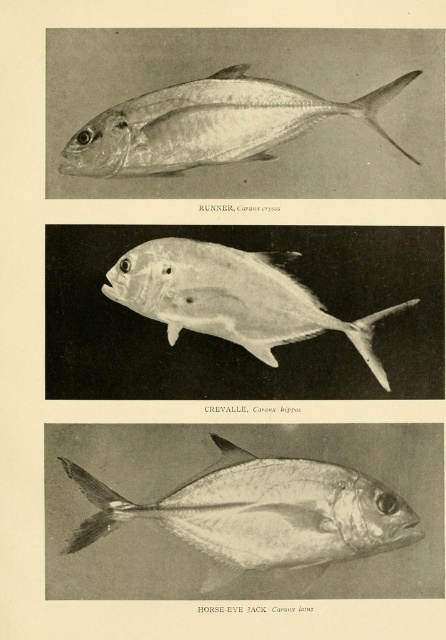
In the scene shown: You are an underwater photographer aiming to capture a closeup of the shiny silver fish at center. Your camera has a maximum focus range of 1.2 meters. Can you take the photo without moving closer than your current position?

The shiny silver fish at center is 1.12 meters away from the camera, which is within the maximum focus range of 1.2 meters. Therefore, you can take the closeup photo without moving closer than your current position.

You are an aquarium designer planning to arrange two silver metallic fish in a tank. You have the silver metallic fish at upper center and the silver metallic fish at center. Based on their positions in the image, which fish should you place higher in the tank to maintain the same spatial relationship?

The silver metallic fish at upper center should be placed higher in the tank since it was positioned above the silver metallic fish at center in the image.

You are an aquarium designer planning to place the shiny silver fish at center and the silver metallic fish at upper center in a tank. Which fish requires a wider space due to its size?

The shiny silver fish at center requires a wider space because its width surpasses that of the silver metallic fish at upper center.